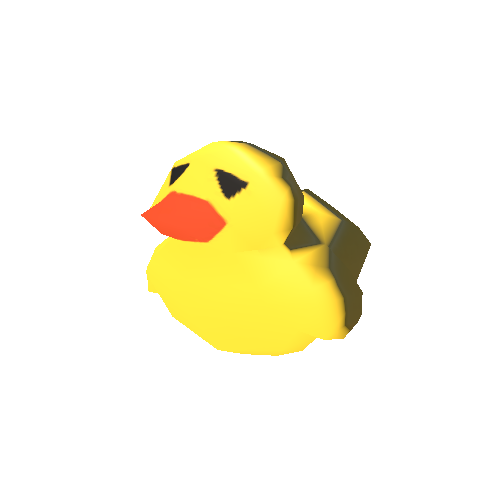
Find the location of a particular element. toy is located at coordinates (297, 314).